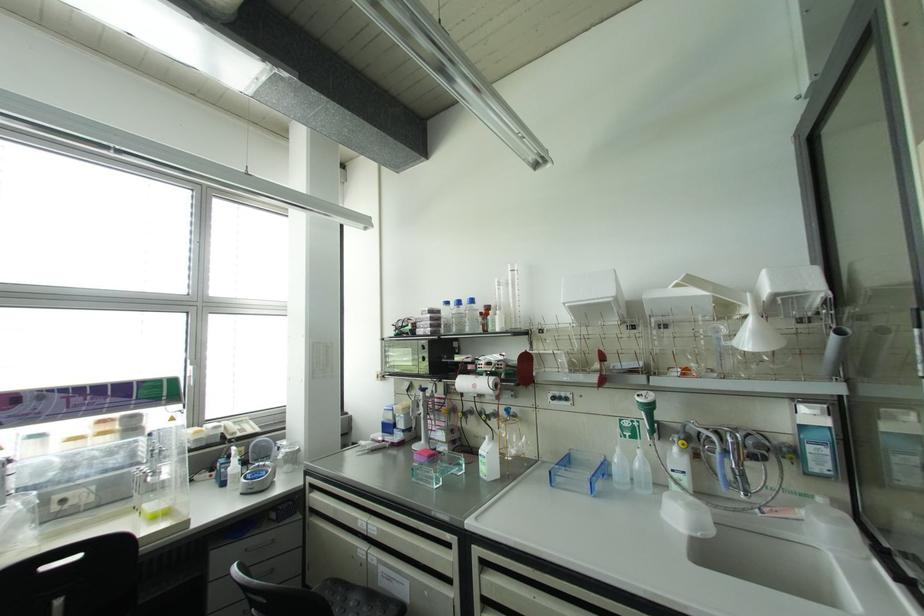
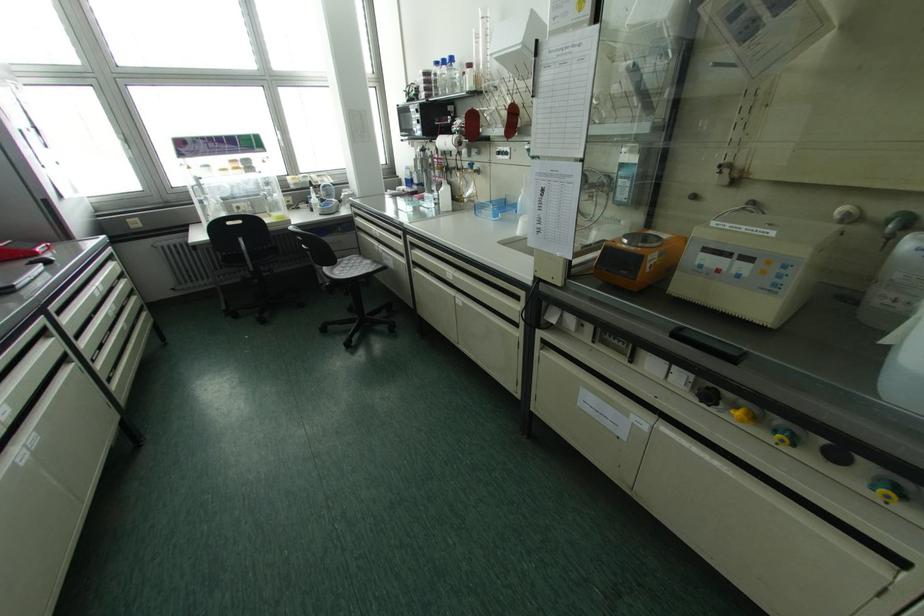
Find the pixel in the second image that matches pixel 471 301 in the first image.

(451, 59)